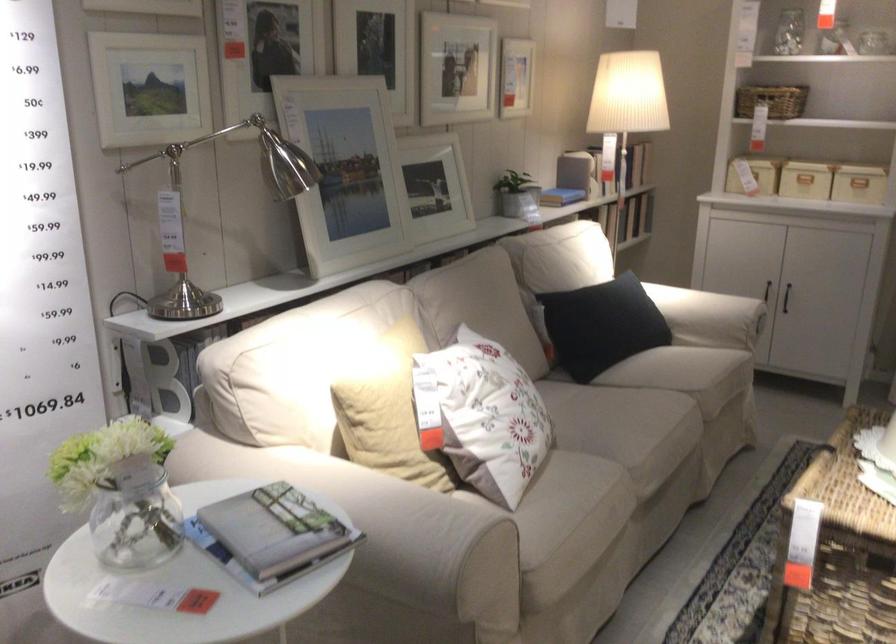
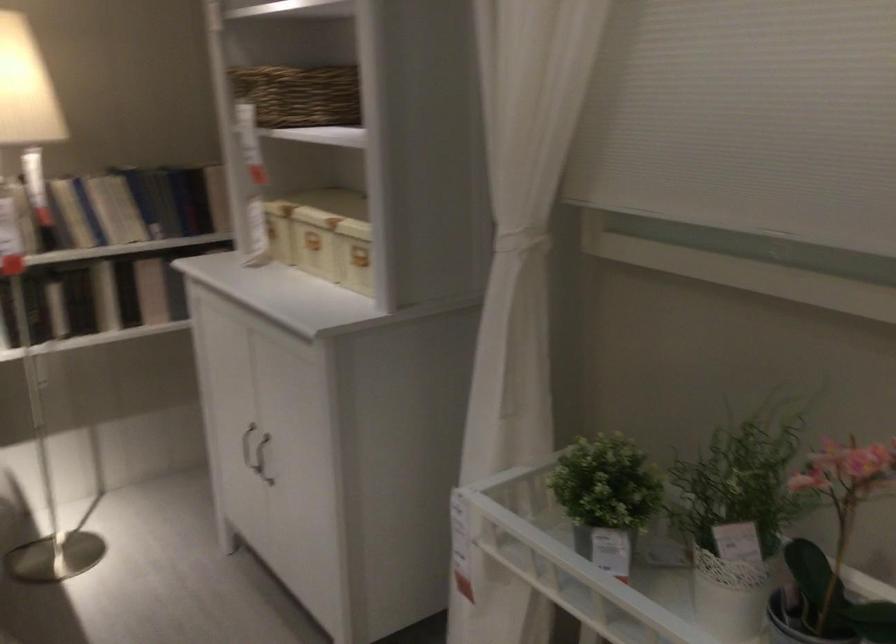
The point at (823,154) is marked in the first image. Where is the corresponding point in the second image?

(314, 242)